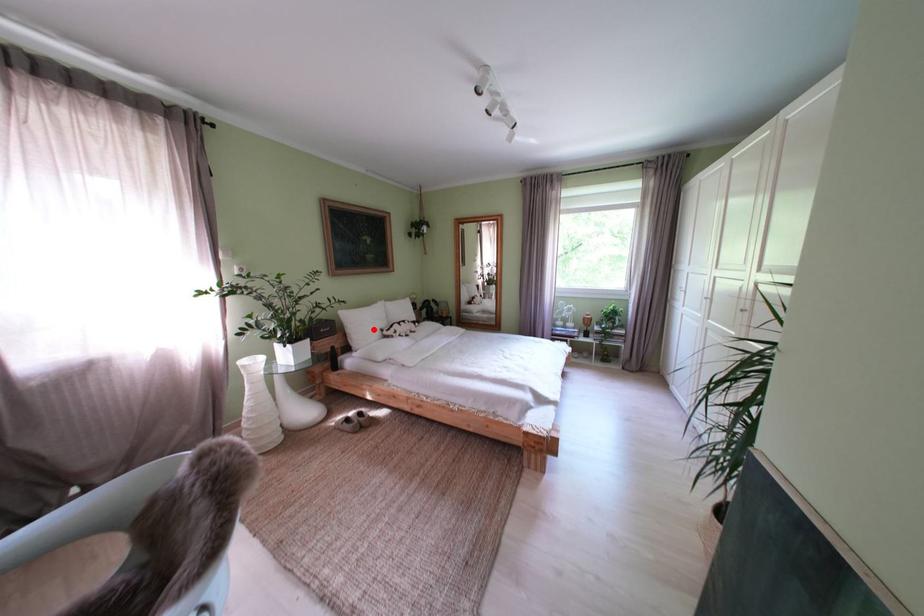
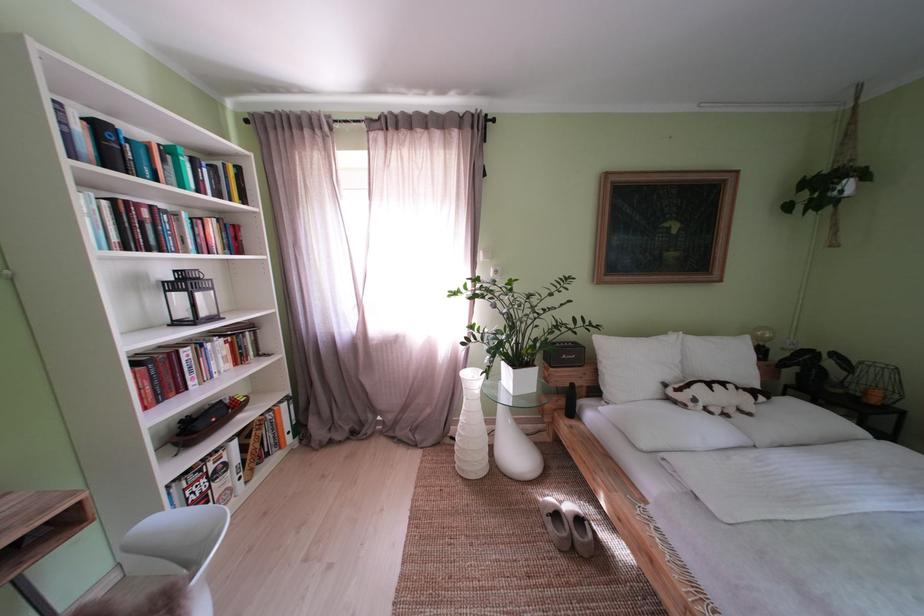
Question: I am providing you with two images of the same scene from different viewpoints. Image1 has a red point marked. In image2, the corresponding 3D location appears at what relative position? Reply with the corresponding letter.

Choices:
 (A) Closer
 (B) Farther

Answer: (B)